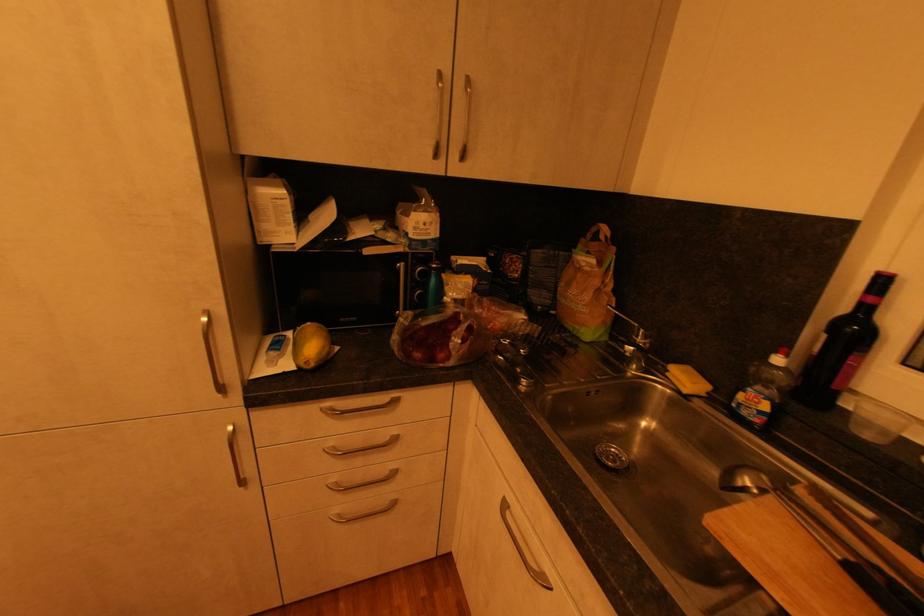
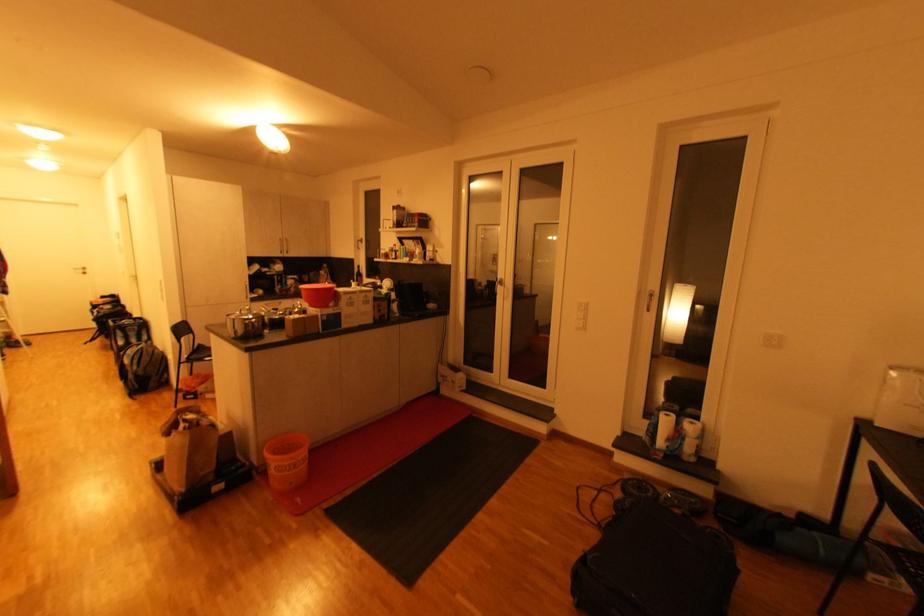
Where in the second image is the point corresponding to point (441, 156) from the first image?

(286, 254)